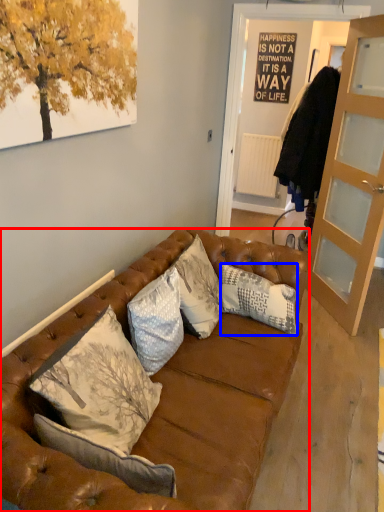
Question: Which object is further to the camera taking this photo, studio couch (highlighted by a red box) or pillow (highlighted by a blue box)?

Choices:
 (A) studio couch
 (B) pillow

Answer: (B)